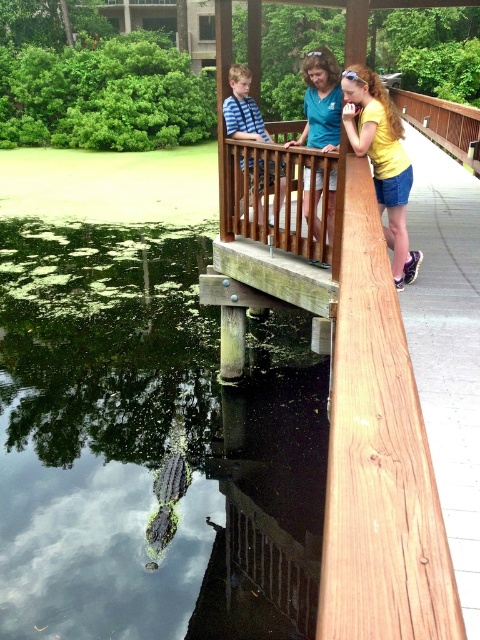
You are a photographer trying to capture a clear shot of the yellow matte shirt at upper right without the wooden railing at upper center blocking the view. Based on their sizes, is this possible?

The wooden railing at upper center is bigger than yellow matte shirt at upper right, so it might block the view of the yellow matte shirt at upper right if positioned between the camera and the shirt.

You are a park ranger guiding visitors on the wooden walkway. You notice the green algae water at lower left and the wooden railing at upper center. Which object is located below the other?

The green algae water at lower left is positioned under the wooden railing at upper center, so the green algae water at lower left is below the wooden railing at upper center.

You are a photographer positioned at the upper center of the scene. You want to capture a shot that includes both the green algae water at lower left and the matte blue shirt at upper center. Which object should you focus on first to ensure both are in frame?

The green algae water at lower left is below the matte blue shirt at upper center, so you should focus on the matte blue shirt at upper center first to ensure both are in frame.